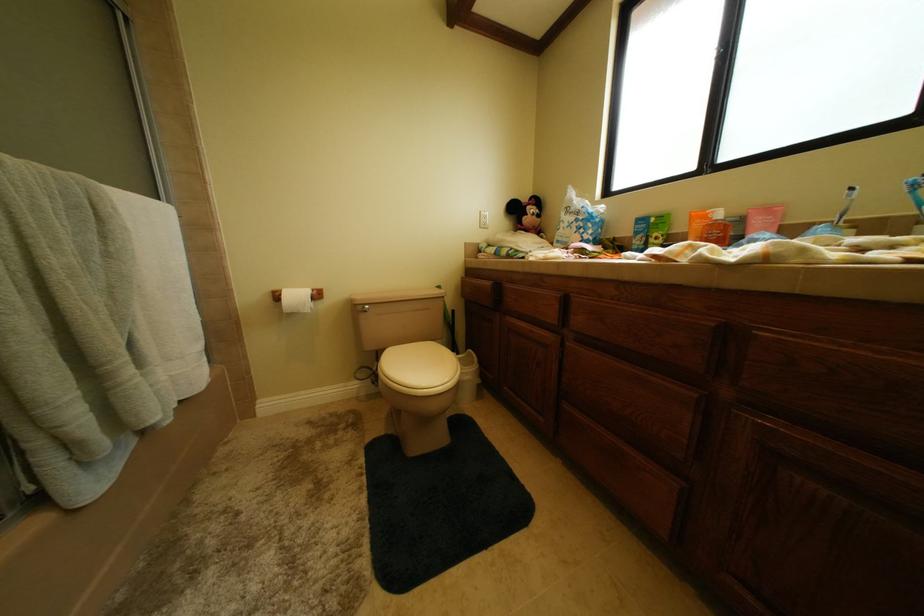
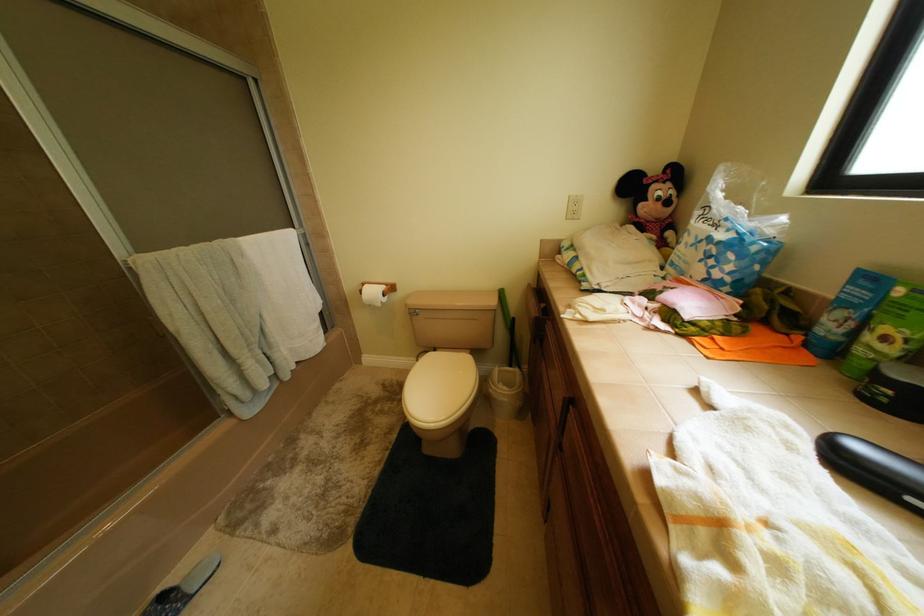
From the picture: Based on the continuous images, in which direction is the camera rotating?

The camera rotated toward left-down.